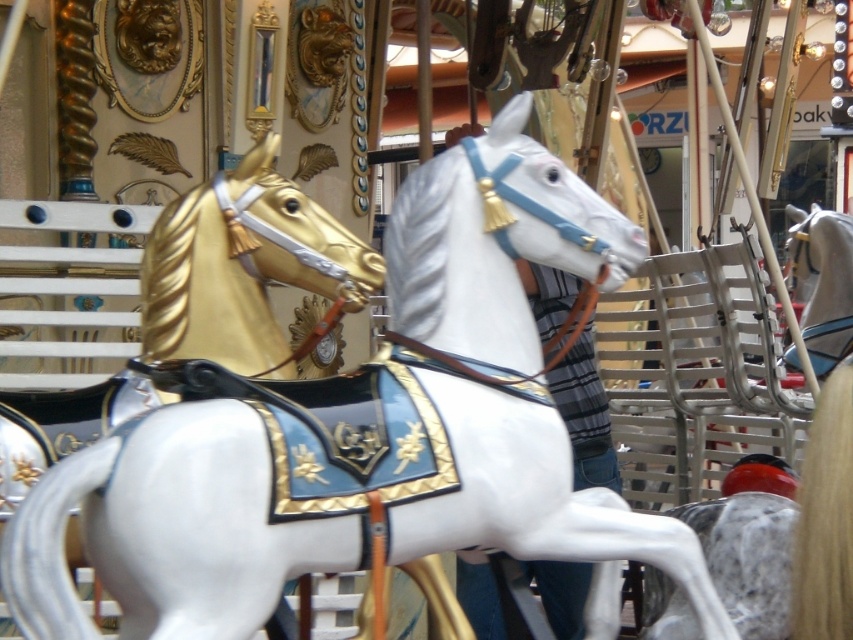
Is white glossy horse at center closer to the viewer compared to gold polished wood horse at upper left?

Yes, white glossy horse at center is closer to the viewer.

Based on the photo, measure the distance from white glossy horse at center to gold polished wood horse at upper left.

white glossy horse at center and gold polished wood horse at upper left are 7.03 feet apart.

Between point (503, 378) and point (178, 262), which one is positioned in front?

Point (503, 378) is more forward.

The image size is (853, 640). I want to click on white glossy horse at center, so click(x=361, y=433).

Who is positioned more to the right, gold polished wood horse at upper left or shiny silver horse at center?

From the viewer's perspective, shiny silver horse at center appears more on the right side.

Consider the image. Is gold polished wood horse at upper left closer to camera compared to shiny silver horse at center?

Yes, gold polished wood horse at upper left is in front of shiny silver horse at center.

Find the location of `gold polished wood horse at upper left`. gold polished wood horse at upper left is located at coordinates (242, 266).

Who is taller, white glossy horse at center or shiny silver horse at center?

With more height is white glossy horse at center.

Does point (506, 490) come in front of point (788, 211)?

Yes, it is.

Does point (201, 486) lie behind point (840, 237)?

No.

Identify the location of white glossy horse at center. This screenshot has width=853, height=640. (361, 433).